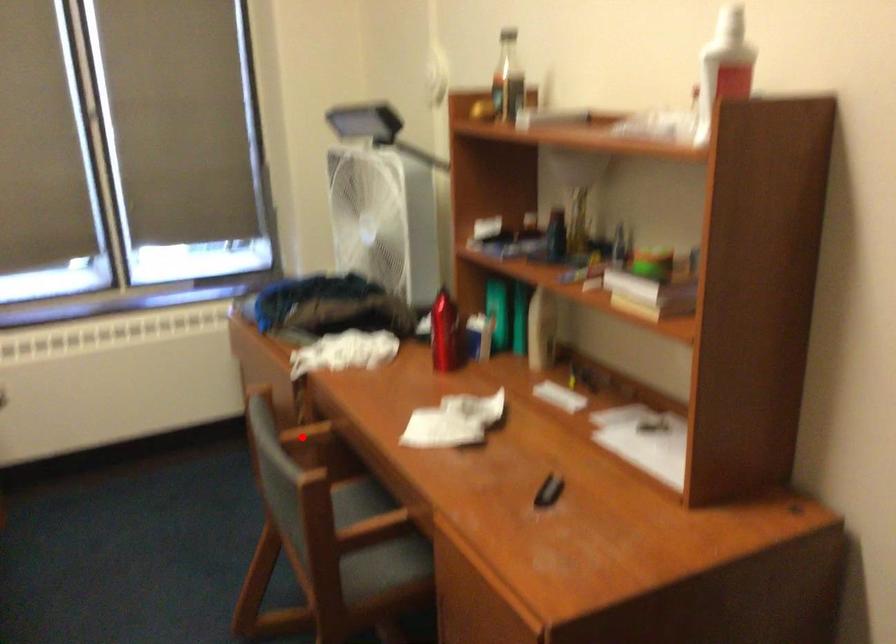
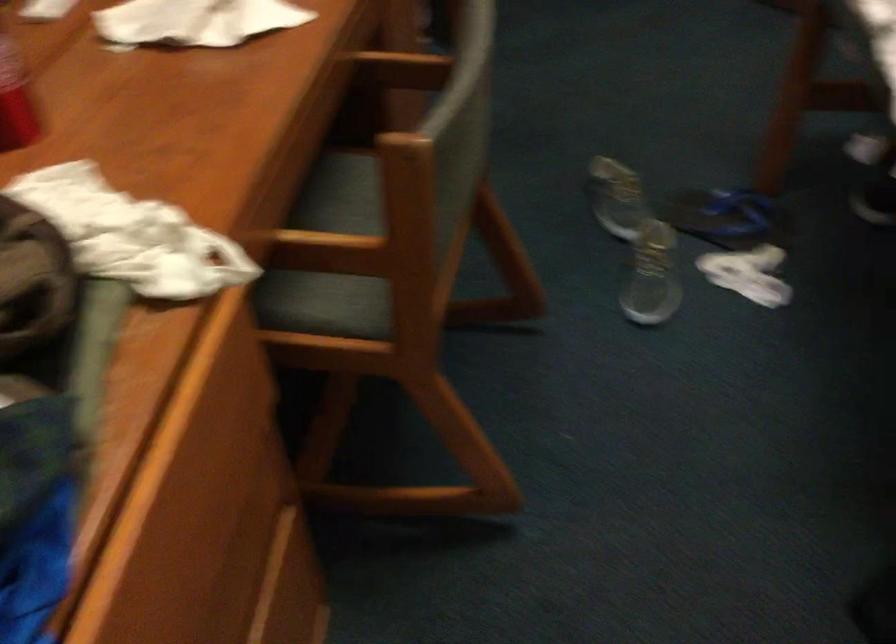
Find the pixel in the second image that matches the highlighted location in the first image.

(339, 250)